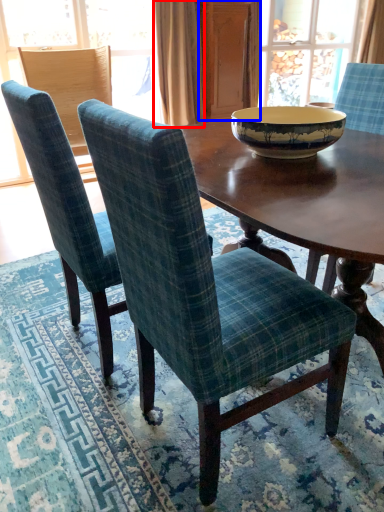
Question: Which point is further to the camera, curtain (highlighted by a red box) or screen door (highlighted by a blue box)?

Choices:
 (A) curtain
 (B) screen door

Answer: (B)